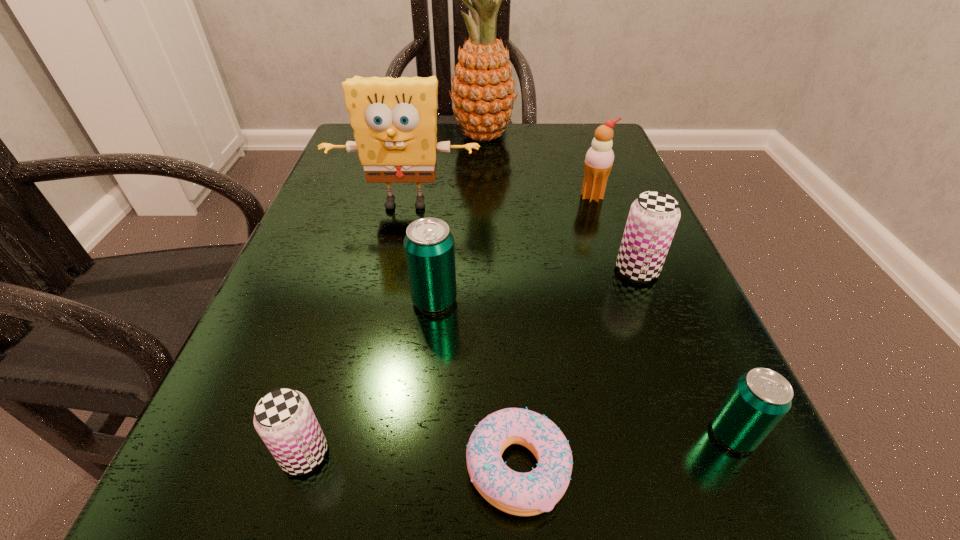
The image size is (960, 540). I want to click on the farthest object, so click(483, 87).

Where is `the tallest object`? This screenshot has height=540, width=960. the tallest object is located at coordinates (483, 87).

Where is `sponge`? Image resolution: width=960 pixels, height=540 pixels. sponge is located at coordinates (394, 120).

This screenshot has height=540, width=960. I want to click on icecream, so click(x=599, y=159).

Locate an element on the screen. The height and width of the screenshot is (540, 960). the right purple beer can is located at coordinates (654, 216).

Find the location of `the bigger purple beer can`. the bigger purple beer can is located at coordinates (654, 216).

The image size is (960, 540). What are the coordinates of `the left teal beer can` in the screenshot? It's located at (429, 248).

The height and width of the screenshot is (540, 960). What are the coordinates of `the third beer can from right to left` in the screenshot? It's located at (429, 248).

At what (x,y) coordinates should I click in order to perform the action: click on the nearer purple beer can. Please return your answer as a coordinate pair (x, y). Looking at the image, I should click on (284, 419).

Where is `the left purple beer can`? the left purple beer can is located at coordinates (284, 419).